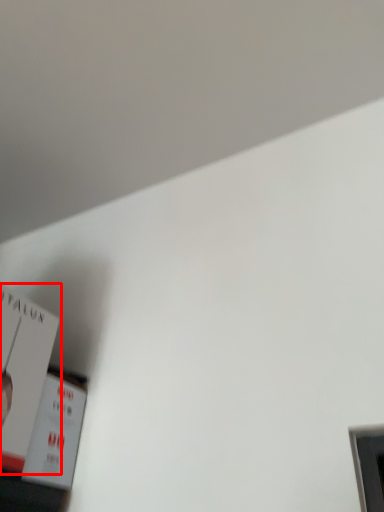
Question: From the image's perspective, where is paperback book (annotated by the red box) located relative to paperback book?

Choices:
 (A) below
 (B) above

Answer: (B)